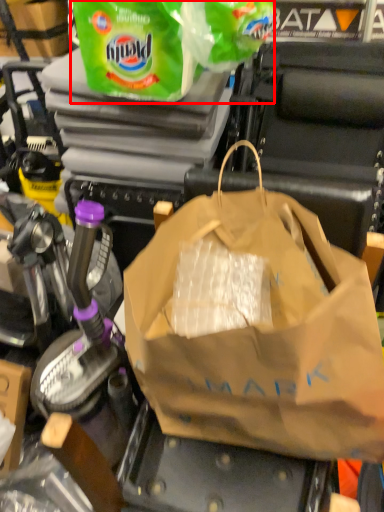
Question: Where is plastic bag (annotated by the red box) located in relation to plastic bag in the image?

Choices:
 (A) right
 (B) left

Answer: (B)